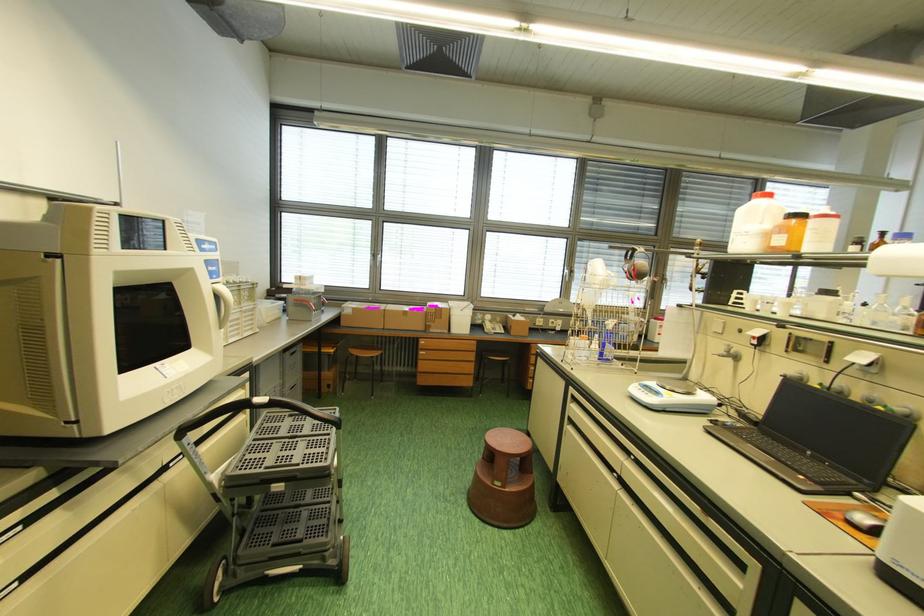
Find where to pull the cart handle. Please return your answer as a coordinate pair (x, y).

(254, 413)